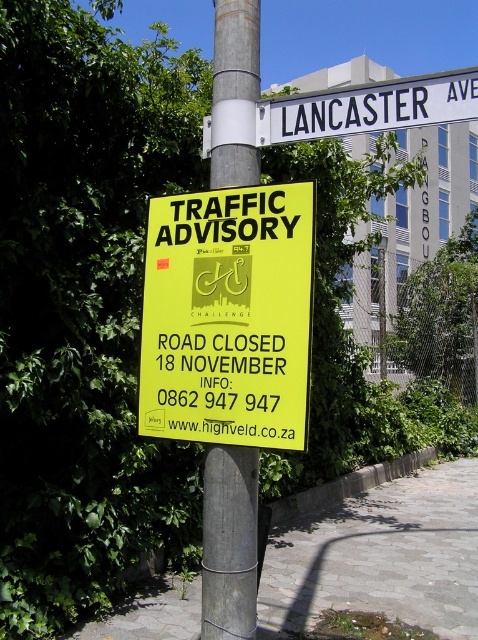
You are a delivery driver who needs to know if your truck can pass between the silver metallic pole at center and the white plastic street sign at upper center. The truck is 1.2 meters wide. Can you fit through the space between them?

The silver metallic pole at center is thinner than the white plastic street sign at upper center, but the description does not provide specific measurements of the space between them. Therefore, it is impossible to determine if the truck can fit through the space based on the given information.

You are a pedestrian standing in front of the silver metallic pole at center and the white plastic street sign at upper center. Which object is positioned to the right?

The white plastic street sign at upper center is to the right of the silver metallic pole at center.